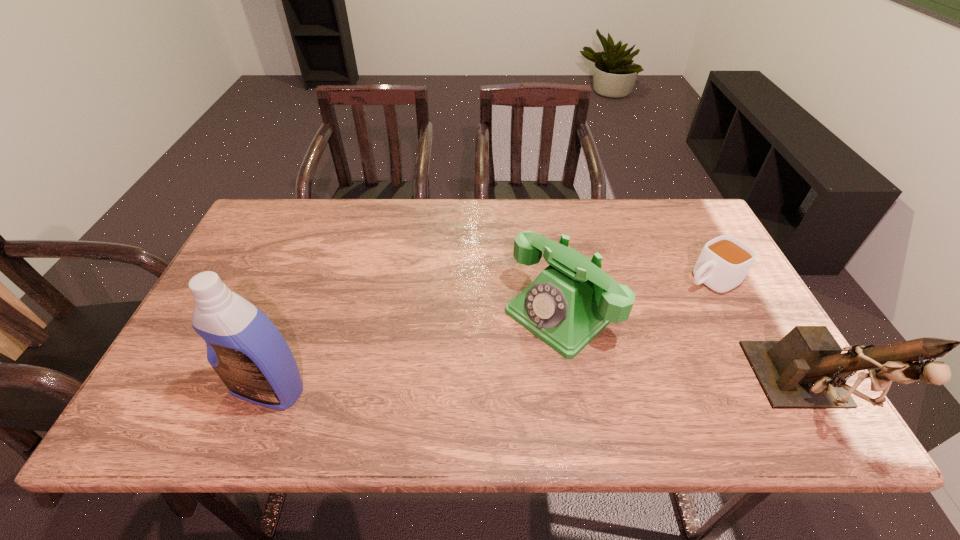
Find the location of `detergent`. detergent is located at coordinates click(246, 350).

Find the location of a particular element. figurine is located at coordinates (806, 369).

I want to click on the third object from right to left, so click(571, 301).

This screenshot has width=960, height=540. I want to click on the second shortest object, so click(571, 301).

The height and width of the screenshot is (540, 960). What are the coordinates of `the shortest object` in the screenshot? It's located at (724, 261).

Find the location of a particular element. vacant space located on the left of the detergent is located at coordinates (162, 388).

The image size is (960, 540). Identify the location of vacant space located 0.170m on the dial of the third object from right to left. (474, 387).

Where is `vacant region located on the dial of the third object from right to left`? Image resolution: width=960 pixels, height=540 pixels. vacant region located on the dial of the third object from right to left is located at coordinates (470, 390).

Find the location of a particular element. free region located on the side with the handle of the shortest object is located at coordinates (648, 308).

Find the location of a particular element. free space located on the side with the handle of the shortest object is located at coordinates (588, 340).